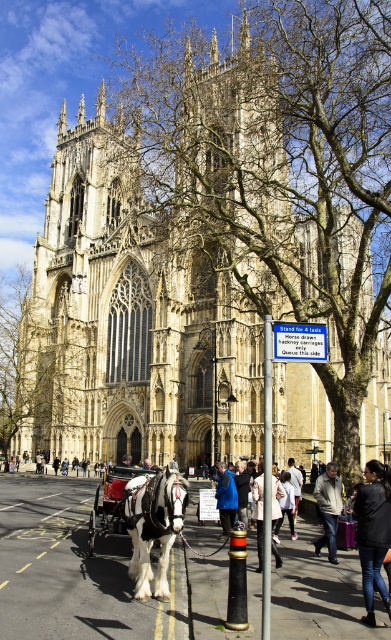
You are standing in front of the Gothic cathedral and want to determine the relative positions of two points marked in the scene. Which point, point 1 at coordinates point (276, 512) or point 2 at coordinates point (229, 493), is closer to you?

→ Point 1 at coordinates point (276, 512) is closer to the viewer than point 2 at coordinates point (229, 493).

You are a tourist standing in front of the Gothic cathedral and see the black glossy horse at center and the shiny black cart at center. Which one is taller?

The black glossy horse at center is much taller than the shiny black cart at center.